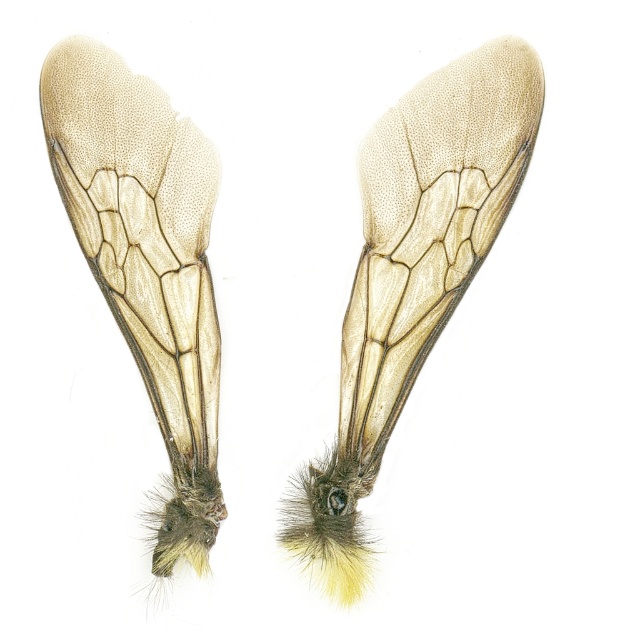
Question: Which of the following is the closest to the observer?

Choices:
 (A) (214, 180)
 (B) (417, 172)

Answer: (B)

Question: Can you confirm if translucent beige wings at center is positioned below translucent beige wing at center?

Choices:
 (A) yes
 (B) no

Answer: (B)

Question: Which of the following is the farthest from the observer?

Choices:
 (A) translucent beige wings at center
 (B) translucent beige wing at center

Answer: (A)

Question: Can you confirm if translucent beige wings at center is wider than translucent beige wing at center?

Choices:
 (A) yes
 (B) no

Answer: (A)

Question: Is translucent beige wings at center thinner than translucent beige wing at center?

Choices:
 (A) yes
 (B) no

Answer: (B)